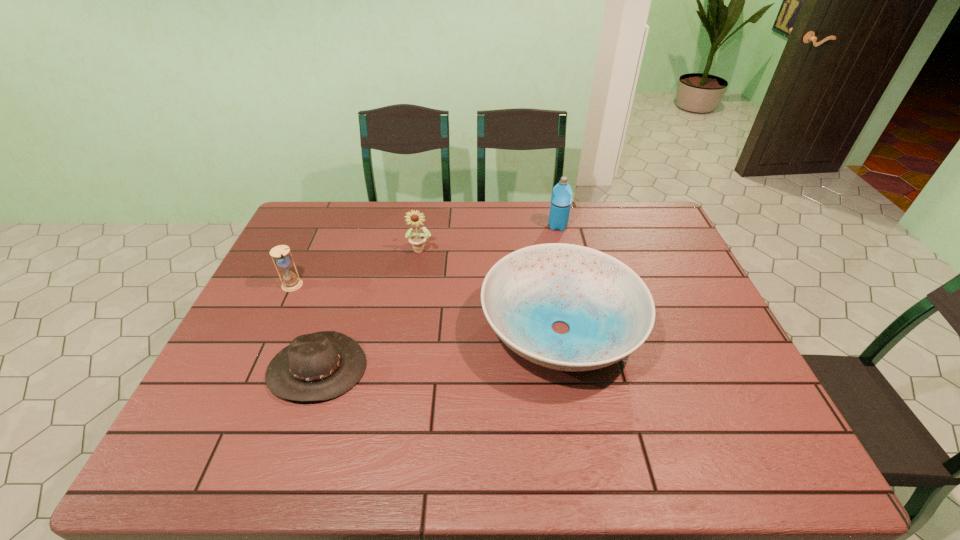
Locate an element on the screen. This screenshot has height=540, width=960. vacant space situated 0.150m on the right of the dish is located at coordinates (697, 329).

At what (x,y) coordinates should I click in order to perform the action: click on blank space located 0.060m on the front-facing side of the fourth object from right to left. Please return your answer as a coordinate pair (x, y). The height and width of the screenshot is (540, 960). Looking at the image, I should click on (297, 430).

Where is `object positioned at the far edge`? This screenshot has width=960, height=540. object positioned at the far edge is located at coordinates (561, 198).

Where is `hourglass positioned at the left edge`? hourglass positioned at the left edge is located at coordinates (290, 282).

Find the location of `hat positioned at the left edge`. hat positioned at the left edge is located at coordinates [x=320, y=366].

Identify the location of vacant region at the far edge of the desktop. The height and width of the screenshot is (540, 960). (494, 225).

Find the location of `vacant space at the near edge`. vacant space at the near edge is located at coordinates (651, 437).

Image resolution: width=960 pixels, height=540 pixels. Identify the location of free space at the right edge. (689, 323).

Locate an element on the screen. free location at the far left corner of the desktop is located at coordinates (291, 229).

Where is `unoccupied area between the dish and the hourglass`? The image size is (960, 540). unoccupied area between the dish and the hourglass is located at coordinates (426, 307).